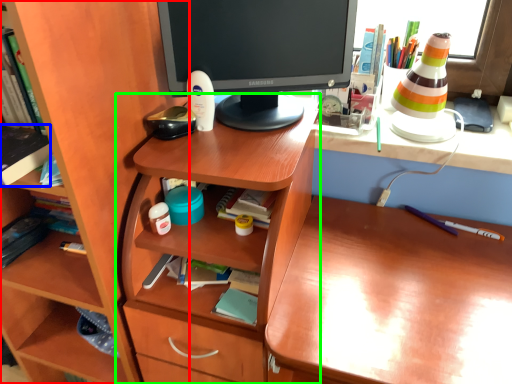
Question: Considering the real-world distances, which object is closest to shelf (highlighted by a red box)? book (highlighted by a blue box) or table (highlighted by a green box).

Choices:
 (A) book
 (B) table

Answer: (B)